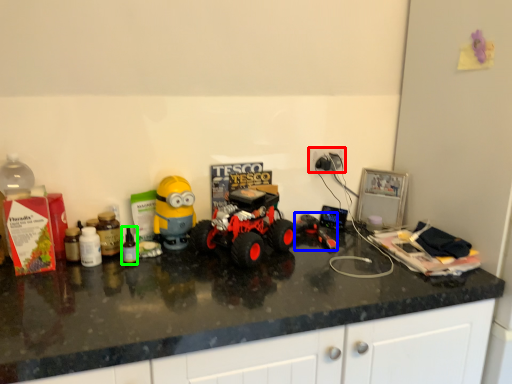
Question: Based on their relative distances, which object is nearer to electric outlet (highlighted by a red box)? Choose from toy (highlighted by a blue box) and bottle (highlighted by a green box).

Choices:
 (A) toy
 (B) bottle

Answer: (A)